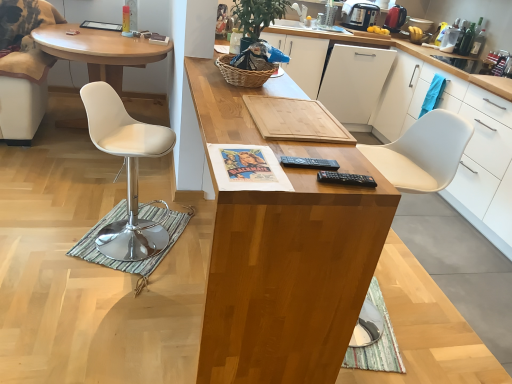
Image resolution: width=512 pixels, height=384 pixels. In order to click on free space behind black plastic remote control at right, marked as the first remote control in a bottom-to-top arrangement in this screenshot , I will do `click(337, 159)`.